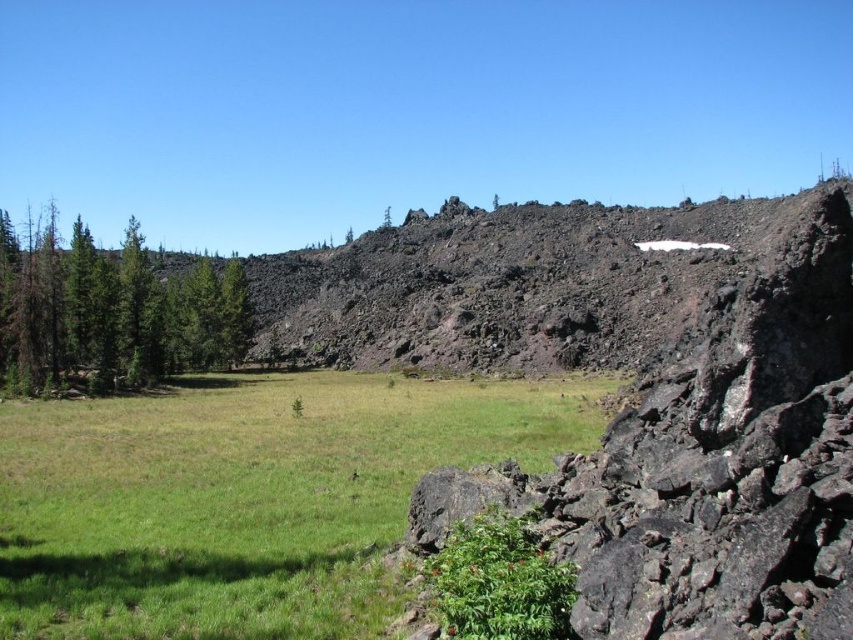
Does point (50, 426) lie in front of point (109, 365)?

Yes, it is.

From the picture: Is green grassy field at center shorter than green matte trees at left?

Yes, green grassy field at center is shorter than green matte trees at left.

Which is behind, point (39, 566) or point (97, 307)?

The point (97, 307) is behind.

Identify the location of green grassy field at center. (245, 499).